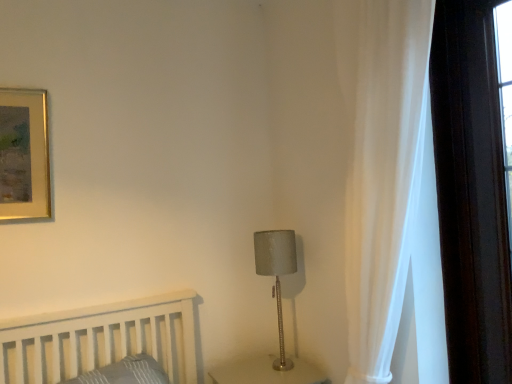
Question: In terms of size, does satin gray lampshade at center-right appear bigger or smaller than white sheer curtain at right?

Choices:
 (A) big
 (B) small

Answer: (B)

Question: Is satin gray lampshade at center-right inside the boundaries of white sheer curtain at right, or outside?

Choices:
 (A) inside
 (B) outside

Answer: (B)

Question: From a real-world perspective, is satin gray lampshade at center-right physically located above or below white sheer curtain at right?

Choices:
 (A) below
 (B) above

Answer: (A)

Question: From a real-world perspective, is white sheer curtain at right physically located above or below satin gray lampshade at center-right?

Choices:
 (A) above
 (B) below

Answer: (A)

Question: Does point (392, 332) appear closer or farther from the camera than point (256, 251)?

Choices:
 (A) closer
 (B) farther

Answer: (A)

Question: In terms of size, does white sheer curtain at right appear bigger or smaller than satin gray lampshade at center-right?

Choices:
 (A) small
 (B) big

Answer: (B)

Question: From the image's perspective, is white sheer curtain at right located above or below satin gray lampshade at center-right?

Choices:
 (A) below
 (B) above

Answer: (B)